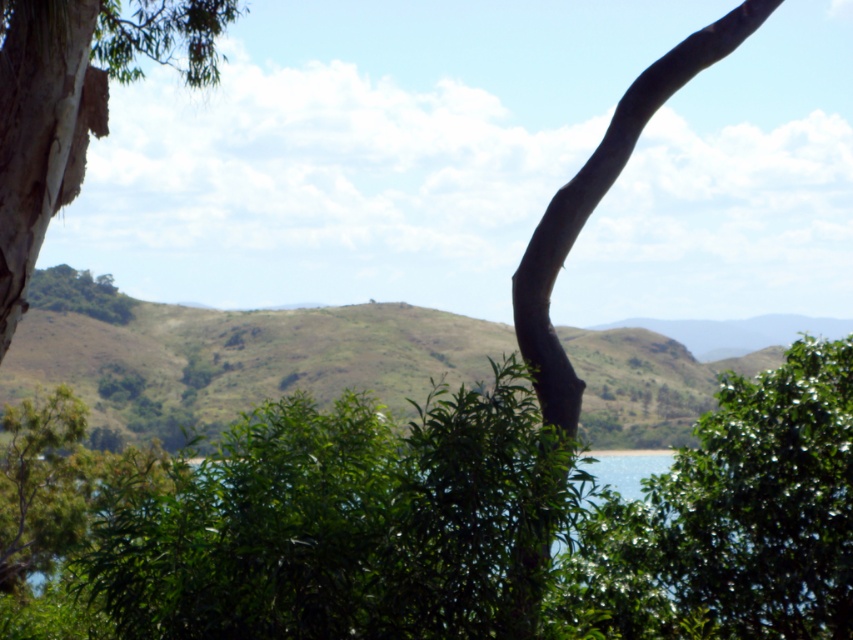
Question: From the image, what is the correct spatial relationship of green leafy tree at center in relation to brown rough bark tree at upper right?

Choices:
 (A) left
 (B) right

Answer: (B)

Question: Which point is closer to the camera?

Choices:
 (A) (563, 216)
 (B) (730, 513)

Answer: (A)

Question: Is green leafy tree at center to the right of brown rough bark tree at upper right from the viewer's perspective?

Choices:
 (A) no
 (B) yes

Answer: (B)

Question: Does green leafy tree at center come behind brown rough bark tree at upper right?

Choices:
 (A) yes
 (B) no

Answer: (B)

Question: Which point is closer to the camera?

Choices:
 (A) brown rough bark tree at upper right
 (B) green leafy tree at center

Answer: (B)

Question: Which object appears farthest from the camera in this image?

Choices:
 (A) brown rough bark tree at upper right
 (B) green leafy tree at center

Answer: (A)